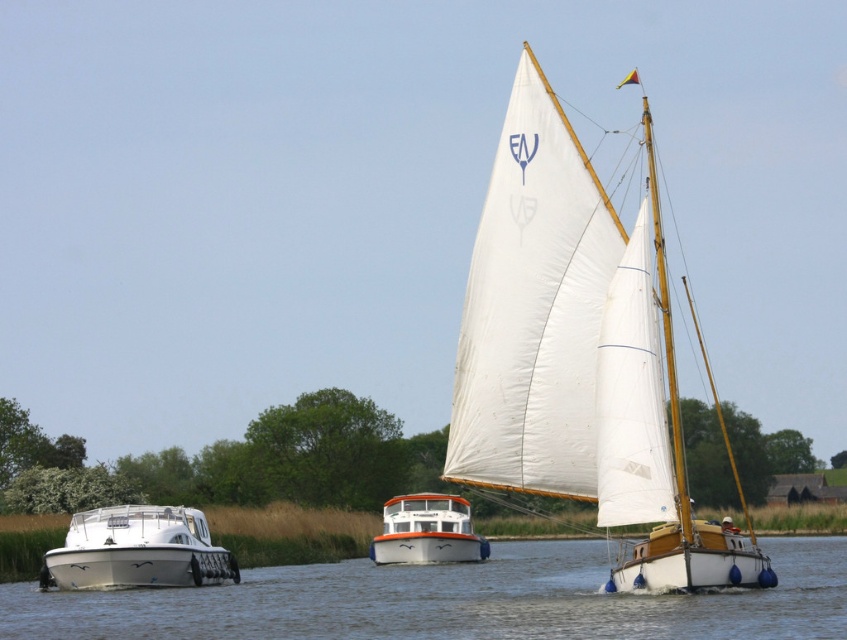
Question: Which point is farther to the camera?

Choices:
 (A) white glossy motorboat at lower left
 (B) white smooth water at lower center
 (C) white canvas sailboat at center
 (D) white glossy boat at center

Answer: (D)

Question: Which is nearer to the white canvas sailboat at center?

Choices:
 (A) white glossy boat at center
 (B) white smooth water at lower center
 (C) white glossy motorboat at lower left

Answer: (B)

Question: Which of the following is the closest to the observer?

Choices:
 (A) white smooth water at lower center
 (B) white glossy motorboat at lower left

Answer: (A)

Question: Can you confirm if white smooth water at lower center is positioned below white glossy boat at center?

Choices:
 (A) yes
 (B) no

Answer: (A)

Question: Is white glossy motorboat at lower left to the right of white glossy boat at center from the viewer's perspective?

Choices:
 (A) no
 (B) yes

Answer: (A)

Question: Does white smooth water at lower center appear under white glossy boat at center?

Choices:
 (A) yes
 (B) no

Answer: (A)